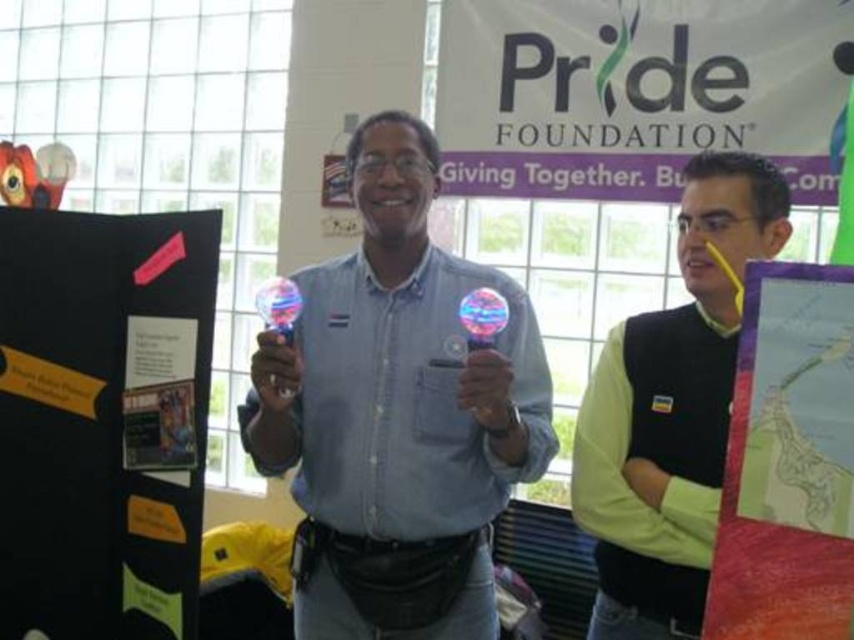
Which is more to the left, blue fabric shirt at center or black cardboard at left?

From the viewer's perspective, black cardboard at left appears more on the left side.

Between blue fabric shirt at center and black cardboard at left, which one is positioned lower?

black cardboard at left is lower down.

Between point (466, 566) and point (177, 406), which one is positioned behind?

The point (466, 566) is more distant.

At what (x,y) coordinates should I click in order to perform the action: click on blue fabric shirt at center. Please return your answer as a coordinate pair (x, y). Looking at the image, I should click on (396, 413).

Is the position of blue fabric shirt at center less distant than that of map paper at right?

That is False.

The width and height of the screenshot is (854, 640). What do you see at coordinates (396, 413) in the screenshot?
I see `blue fabric shirt at center` at bounding box center [396, 413].

Between point (449, 268) and point (743, 339), which one is positioned in front?

Point (743, 339)

What are the coordinates of `blue fabric shirt at center` in the screenshot? It's located at (396, 413).

Does point (244, 401) come in front of point (683, 268)?

No.

Which is above, blue fabric shirt at center or green matte vest at center?

Positioned higher is blue fabric shirt at center.

Who is more distant from viewer, (351, 305) or (677, 492)?

Point (351, 305)

Find the location of a particular element. blue fabric shirt at center is located at coordinates pyautogui.click(x=396, y=413).